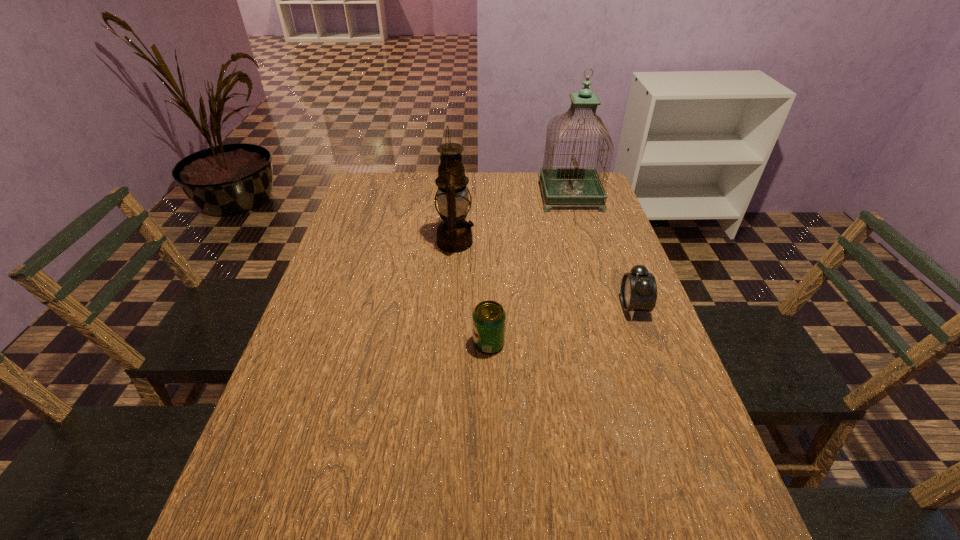
The height and width of the screenshot is (540, 960). Identify the location of blank space at the left edge of the desktop. (329, 307).

The width and height of the screenshot is (960, 540). I want to click on vacant space at the right edge of the desktop, so click(654, 381).

In order to click on free location at the far left corner of the desktop in this screenshot , I will do `click(395, 179)`.

At what (x,y) coordinates should I click in order to perform the action: click on unoccupied position between the second object from left to right and the tallest object. Please return your answer as a coordinate pair (x, y). Looking at the image, I should click on (530, 270).

Identify the location of vacant area that lies between the birdcage and the nearest object. (530, 270).

Find the location of `free space between the nearest object and the alarm clock`. free space between the nearest object and the alarm clock is located at coordinates [x=561, y=325].

This screenshot has width=960, height=540. Identify the location of free space between the second object from left to right and the alarm clock. (561, 325).

This screenshot has height=540, width=960. In order to click on vacant area that lies between the oil lamp and the second nearest object in this screenshot , I will do `click(544, 274)`.

Locate an element on the screen. This screenshot has width=960, height=540. free point between the beer can and the alarm clock is located at coordinates (561, 325).

Locate an element on the screen. blank region between the tallest object and the second tallest object is located at coordinates [x=513, y=219].